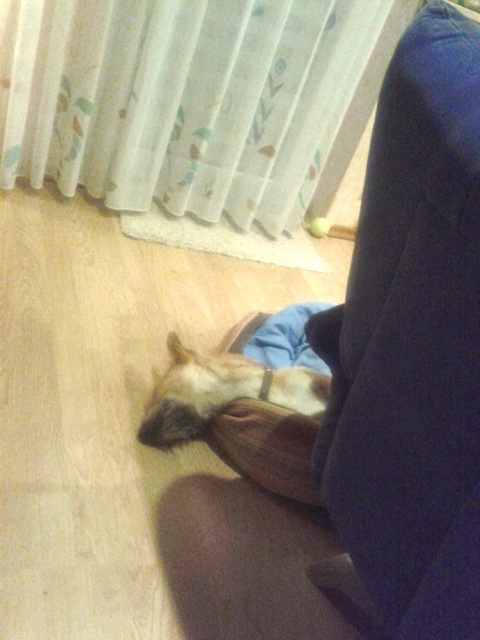
Based on the scene description, where is the white sheer curtain at upper center located in terms of its coordinates?

The white sheer curtain at upper center is located at coordinates point (192, 100).

You are a photographer setting up a shoot in the room. You want to place a small yellow ball between the fuzzy brown dog at lower center and the brown fabric pillow at lower center. Is this possible given their positions?

The brown fabric pillow at lower center is behind the fuzzy brown dog at lower center, so placing the yellow ball between them would require placing it in front of the dog, as the pillow is already behind the dog. However, since the pillow is behind the dog, the ball can be placed between them by positioning it in front of the dog but near the pillow.

You are standing in the room and want to hang a picture frame between the white sheer curtain at upper center and the brown fabric pillow at lower center. Which object should the frame be placed above to ensure it is higher?

The white sheer curtain at upper center is taller than the brown fabric pillow at lower center, so placing the picture frame above the white sheer curtain at upper center will ensure it is higher.